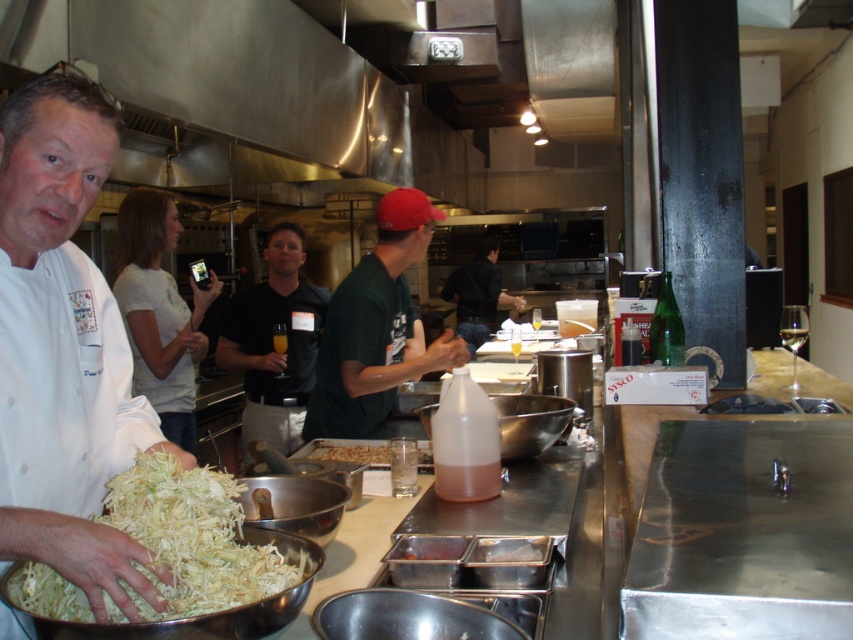
Question: Does white shredded food at left appear on the left side of translucent plastic nuts at center?

Choices:
 (A) yes
 (B) no

Answer: (A)

Question: Can you confirm if green matte shirt at center is thinner than black matte shirt at center?

Choices:
 (A) no
 (B) yes

Answer: (A)

Question: Estimate the real-world distances between objects in this image. Which object is farther from the green matte shirt at center?

Choices:
 (A) black matte shirt at center
 (B) white shredded food at left
 (C) white chef coat at center
 (D) translucent plastic nuts at center

Answer: (B)

Question: Which of the following is the farthest from the observer?

Choices:
 (A) white chef coat at center
 (B) green matte shirt at center
 (C) white shredded food at left
 (D) black matte shirt at center

Answer: (D)

Question: Estimate the real-world distances between objects in this image. Which object is farther from the black matte shirt at center?

Choices:
 (A) white chef coat at center
 (B) white shredded food at left
 (C) translucent plastic nuts at center

Answer: (B)

Question: Is green matte shirt at center positioned in front of black matte shirt at center?

Choices:
 (A) no
 (B) yes

Answer: (B)